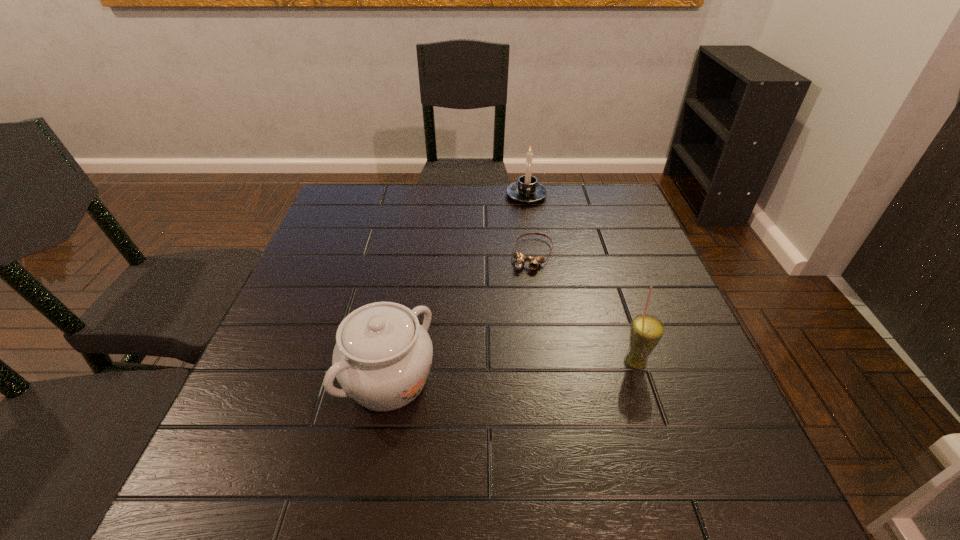
The width and height of the screenshot is (960, 540). Identify the location of vacant space on the desktop that is between the chinaware and the straw for drinking and is positioned with a handle on the side of the candle holder. (546, 369).

You are a GUI agent. You are given a task and a screenshot of the screen. Output one action in this format:
    pyautogui.click(x=<x>, y=<y>)
    Task: Click on the vacant space on the desktop that is between the chinaware and the rightmost object and is positioned on the front lenses and sides of the goggles
    The image size is (960, 540).
    Given the screenshot: What is the action you would take?
    pyautogui.click(x=491, y=373)